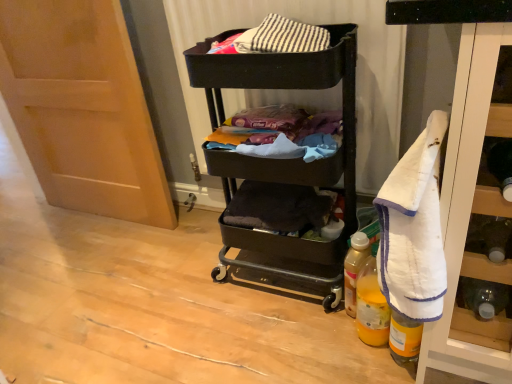
Question: Is black matte cart at center to the right of translucent yellow plastic bottle at lower right, the second bottle when ordered from back to front, from the viewer's perspective?

Choices:
 (A) yes
 (B) no

Answer: (B)

Question: Could you tell me if black matte cart at center is turned towards translucent yellow plastic bottle at lower right, which is the 2th bottle in front-to-back order?

Choices:
 (A) no
 (B) yes

Answer: (A)

Question: From a real-world perspective, does black matte cart at center stand above translucent yellow plastic bottle at lower right, which is the 2th bottle in front-to-back order?

Choices:
 (A) no
 (B) yes

Answer: (B)

Question: From the image's perspective, is black matte cart at center below translucent yellow plastic bottle at lower right, the second bottle when ordered from back to front?

Choices:
 (A) yes
 (B) no

Answer: (B)

Question: From a real-world perspective, is black matte cart at center positioned under translucent yellow plastic bottle at lower right, which is the 2th bottle in front-to-back order, based on gravity?

Choices:
 (A) yes
 (B) no

Answer: (B)

Question: Can you confirm if black matte cart at center is taller than translucent yellow plastic bottle at lower right, which is the 2th bottle in front-to-back order?

Choices:
 (A) no
 (B) yes

Answer: (B)

Question: Is matte wood door at left further to the viewer compared to translucent yellow plastic bottle at lower right, which is the 2th bottle in front-to-back order?

Choices:
 (A) no
 (B) yes

Answer: (B)

Question: Does matte wood door at left appear on the right side of translucent yellow plastic bottle at lower right, the second bottle when ordered from back to front?

Choices:
 (A) no
 (B) yes

Answer: (A)

Question: From a real-world perspective, is matte wood door at left positioned over translucent yellow plastic bottle at lower right, which is the 2th bottle in front-to-back order, based on gravity?

Choices:
 (A) no
 (B) yes

Answer: (B)

Question: Is matte wood door at left bigger than translucent yellow plastic bottle at lower right, which is the 2th bottle in front-to-back order?

Choices:
 (A) no
 (B) yes

Answer: (B)

Question: From the image's perspective, is matte wood door at left over translucent yellow plastic bottle at lower right, the second bottle when ordered from back to front?

Choices:
 (A) no
 (B) yes

Answer: (B)

Question: Is matte wood door at left aimed at translucent yellow plastic bottle at lower right, which is the 2th bottle in front-to-back order?

Choices:
 (A) no
 (B) yes

Answer: (A)

Question: From a real-world perspective, is matte wood door at left located beneath translucent plastic bottle at lower right, which appears as the first bottle when viewed from the back?

Choices:
 (A) yes
 (B) no

Answer: (B)